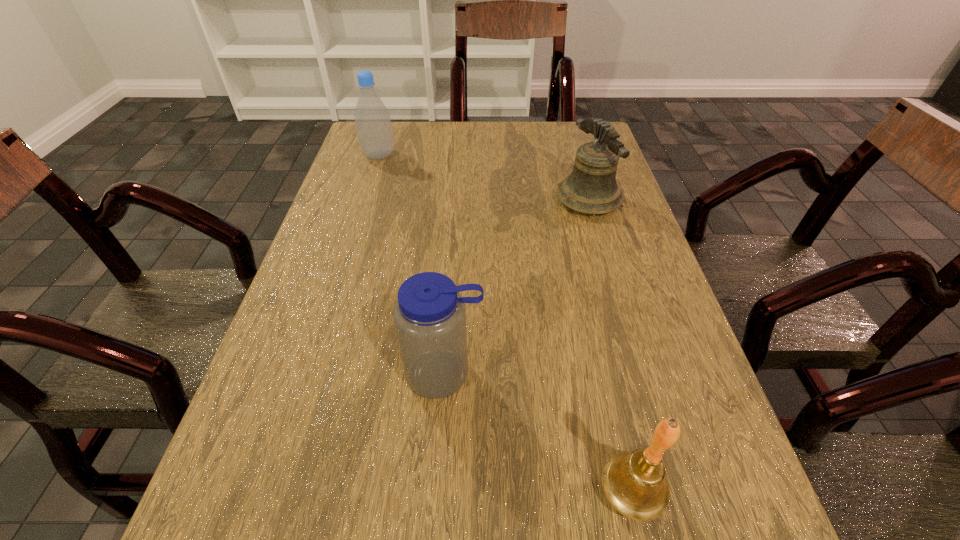
The height and width of the screenshot is (540, 960). Find the location of `vacant area that lies between the nearer bell and the water bottle`. vacant area that lies between the nearer bell and the water bottle is located at coordinates (538, 433).

Where is `free spot between the farthest object and the farther bell`? Image resolution: width=960 pixels, height=540 pixels. free spot between the farthest object and the farther bell is located at coordinates (484, 178).

Locate an element on the screen. vacant space that's between the nearer bell and the water bottle is located at coordinates (538, 433).

Locate an element on the screen. This screenshot has height=540, width=960. vacant point located between the third farthest object and the nearest object is located at coordinates (538, 433).

The height and width of the screenshot is (540, 960). Find the location of `free space between the leftmost object and the second farthest object`. free space between the leftmost object and the second farthest object is located at coordinates (484, 178).

Locate an element on the screen. free space between the second object from left to right and the leftmost object is located at coordinates (412, 265).

You are a GUI agent. You are given a task and a screenshot of the screen. Output one action in this format:
    pyautogui.click(x=<x>, y=<y>)
    Task: Click on the unoccupied area between the third object from right to left and the nearer bell
    The height and width of the screenshot is (540, 960).
    Given the screenshot: What is the action you would take?
    pyautogui.click(x=538, y=433)

In order to click on the closest object relative to the farther bell in this screenshot , I will do `click(429, 315)`.

Identify which object is the third nearest to the third nearest object. Please provide its 2D coordinates. Your answer should be formatted as a tuple, i.e. [(x, y)], where the tuple contains the x and y coordinates of a point satisfying the conditions above.

[(635, 484)]

This screenshot has width=960, height=540. What are the coordinates of `free space in the image that satisfies the following two spatial constraints: 1. on the front side of the second farthest object; 2. on the right side of the farthest object` in the screenshot? It's located at (365, 200).